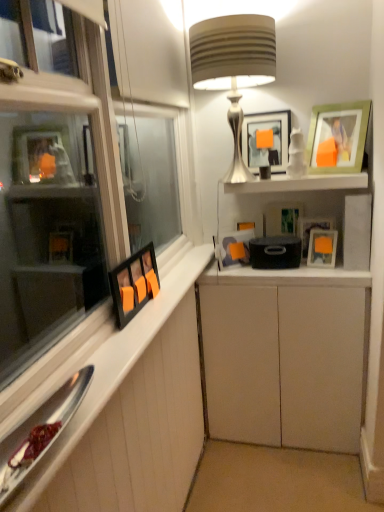
Question: From a real-world perspective, is matte black picture frame at upper right, the sixth picture frame when ordered from left to right, located higher than white matte cabinet at center, the 2th cabinetry in the left-to-right sequence?

Choices:
 (A) yes
 (B) no

Answer: (A)

Question: From the image's perspective, does matte black picture frame at upper right, the sixth picture frame when ordered from left to right, appear higher than white matte cabinet at center, positioned as the first cabinetry in right-to-left order?

Choices:
 (A) no
 (B) yes

Answer: (B)

Question: Does matte black picture frame at upper right, arranged as the 2th picture frame when viewed from the right, touch white matte cabinet at center, positioned as the first cabinetry in right-to-left order?

Choices:
 (A) yes
 (B) no

Answer: (B)

Question: Does matte black picture frame at upper right, arranged as the 2th picture frame when viewed from the right, lie behind white matte cabinet at center, the 2th cabinetry in the left-to-right sequence?

Choices:
 (A) no
 (B) yes

Answer: (B)

Question: Would you say matte black picture frame at upper right, arranged as the 2th picture frame when viewed from the right, is outside white matte cabinet at center, positioned as the first cabinetry in right-to-left order?

Choices:
 (A) no
 (B) yes

Answer: (B)

Question: From a real-world perspective, does matte black picture frame at upper center, the 3th picture frame positioned from the left, stand above white matte cabinet at center, positioned as the first cabinetry in right-to-left order?

Choices:
 (A) no
 (B) yes

Answer: (B)

Question: Is matte black picture frame at upper center, the 3th picture frame positioned from the left, at the left side of white matte cabinet at center, the 2th cabinetry in the left-to-right sequence?

Choices:
 (A) yes
 (B) no

Answer: (A)

Question: Is matte black picture frame at upper center, the 5th picture frame from the right, taller than white matte cabinet at center, positioned as the first cabinetry in right-to-left order?

Choices:
 (A) no
 (B) yes

Answer: (A)

Question: Considering the relative sizes of matte black picture frame at upper center, the 5th picture frame from the right, and white matte cabinet at center, positioned as the first cabinetry in right-to-left order, in the image provided, is matte black picture frame at upper center, the 5th picture frame from the right, bigger than white matte cabinet at center, positioned as the first cabinetry in right-to-left order,?

Choices:
 (A) no
 (B) yes

Answer: (A)

Question: Are matte black picture frame at upper center, the 3th picture frame positioned from the left, and white matte cabinet at center, positioned as the first cabinetry in right-to-left order, located far from each other?

Choices:
 (A) no
 (B) yes

Answer: (A)

Question: From the image's perspective, is matte black picture frame at upper center, the 3th picture frame positioned from the left, below white matte cabinet at center, positioned as the first cabinetry in right-to-left order?

Choices:
 (A) yes
 (B) no

Answer: (B)

Question: Is white wood cabinet at left, which is the second cabinetry from right to left, far away from green matte picture frame at upper right, the first picture frame positioned from the right?

Choices:
 (A) no
 (B) yes

Answer: (B)